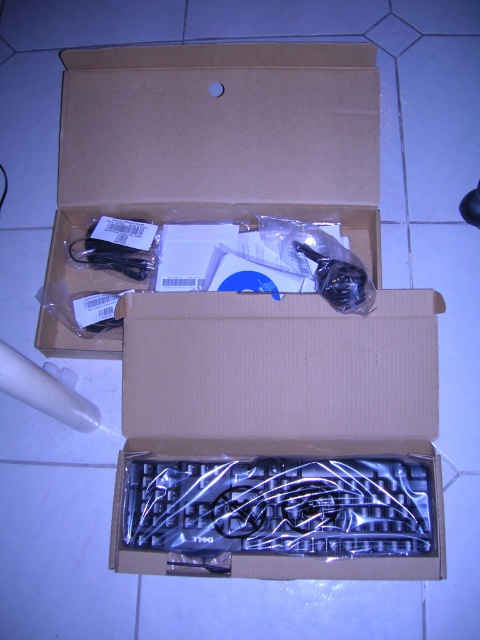
Is clear plastic keyboard at center positioned before brown cardboard box at upper center?

Yes, it is.

I want to click on clear plastic keyboard at center, so click(x=278, y=436).

Between point (167, 525) and point (290, 84), which one is positioned behind?

Positioned behind is point (290, 84).

The image size is (480, 640). Identify the location of clear plastic keyboard at center. (278, 436).